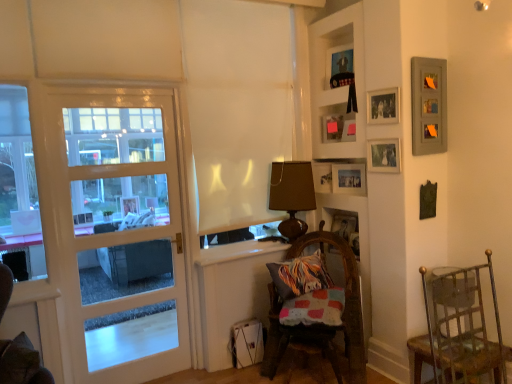
Question: Considering the relative positions of white matte curtain at center and wooden photo frame at upper right, positioned as the 5th picture frame in bottom-to-top order, in the image provided, is white matte curtain at center to the right of wooden photo frame at upper right, positioned as the 5th picture frame in bottom-to-top order, from the viewer's perspective?

Choices:
 (A) no
 (B) yes

Answer: (A)

Question: Considering the relative positions of white matte curtain at center and wooden photo frame at upper right, which is counted as the second picture frame, starting from the top, in the image provided, is white matte curtain at center in front of wooden photo frame at upper right, which is counted as the second picture frame, starting from the top,?

Choices:
 (A) yes
 (B) no

Answer: (B)

Question: From a real-world perspective, is white matte curtain at center on wooden photo frame at upper right, positioned as the 5th picture frame in bottom-to-top order?

Choices:
 (A) yes
 (B) no

Answer: (B)

Question: Would you say wooden photo frame at upper right, which is counted as the second picture frame, starting from the top, is part of white matte curtain at center's contents?

Choices:
 (A) yes
 (B) no

Answer: (B)

Question: Does white matte curtain at center have a greater height compared to wooden photo frame at upper right, positioned as the 5th picture frame in bottom-to-top order?

Choices:
 (A) no
 (B) yes

Answer: (B)

Question: Is white matte curtain at center thinner than wooden photo frame at upper right, which is counted as the second picture frame, starting from the top?

Choices:
 (A) yes
 (B) no

Answer: (B)

Question: Can you confirm if matte wooden picture frame at upper center, which is counted as the 1th picture frame, starting from the top, is smaller than multicolored woven pillow at lower center?

Choices:
 (A) yes
 (B) no

Answer: (A)

Question: Is multicolored woven pillow at lower center a part of matte wooden picture frame at upper center, which is counted as the 1th picture frame, starting from the top?

Choices:
 (A) yes
 (B) no

Answer: (B)

Question: Is matte wooden picture frame at upper center, the 6th picture frame positioned from the bottom, aimed at multicolored woven pillow at lower center?

Choices:
 (A) yes
 (B) no

Answer: (B)

Question: Is matte wooden picture frame at upper center, which is counted as the 1th picture frame, starting from the top, at the right side of multicolored woven pillow at lower center?

Choices:
 (A) no
 (B) yes

Answer: (B)

Question: Is matte wooden picture frame at upper center, the 6th picture frame positioned from the bottom, located outside multicolored woven pillow at lower center?

Choices:
 (A) no
 (B) yes

Answer: (B)

Question: Is matte wooden picture frame at upper center, which is counted as the 1th picture frame, starting from the top, beside multicolored woven pillow at lower center?

Choices:
 (A) no
 (B) yes

Answer: (A)

Question: Is matte wooden picture frame at upper center, which is counted as the 1th picture frame, starting from the top, thinner than wooden photo frame at upper right, positioned as the 5th picture frame in bottom-to-top order?

Choices:
 (A) yes
 (B) no

Answer: (B)